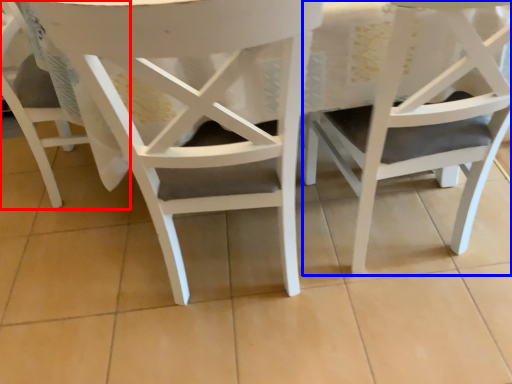
Question: Among these objects, which one is nearest to the camera, chair (highlighted by a red box) or chair (highlighted by a blue box)?

Choices:
 (A) chair
 (B) chair

Answer: (B)